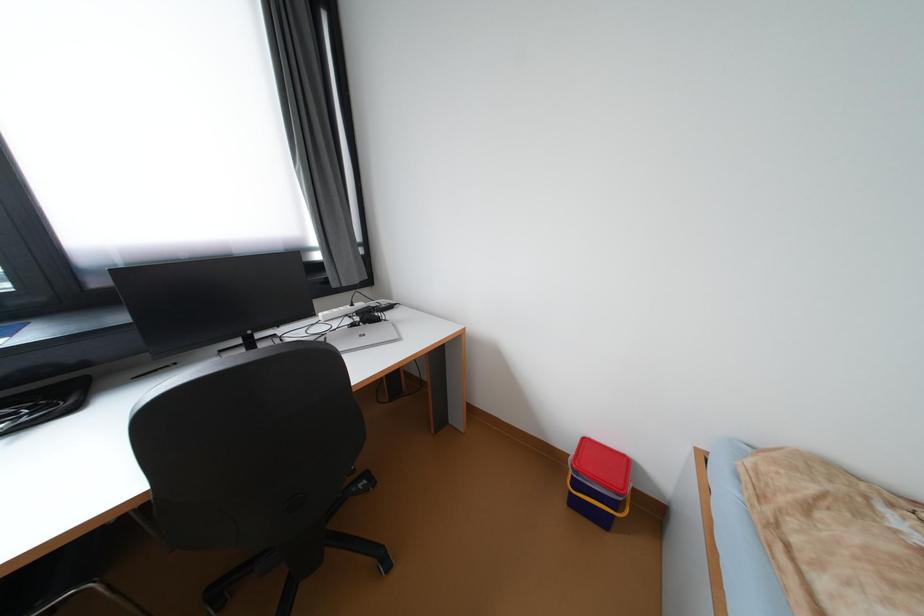
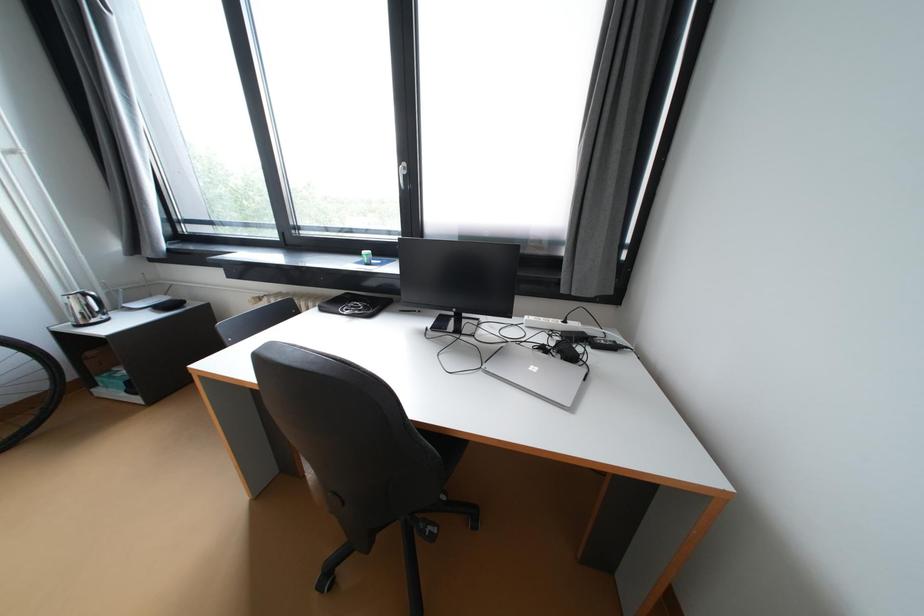
Question: Based on the continuous images, in which direction is the camera rotating? Reply with the corresponding letter.

Choices:
 (A) Left
 (B) Right
 (C) Up
 (D) Down

Answer: (A)